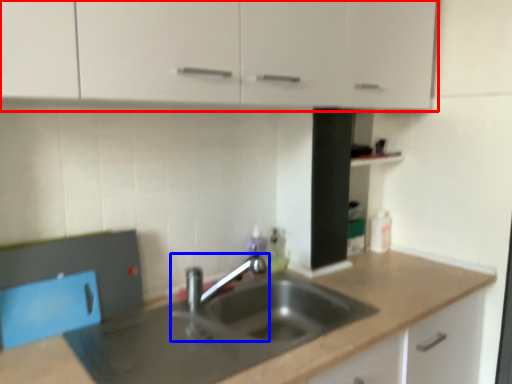
Question: Which point is closer to the camera, cabinetry (highlighted by a red box) or tap (highlighted by a blue box)?

Choices:
 (A) cabinetry
 (B) tap

Answer: (A)